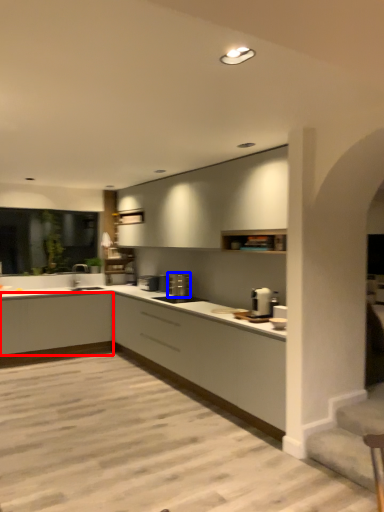
Question: Which point is further to the camera, cabinetry (highlighted by a red box) or appliance (highlighted by a blue box)?

Choices:
 (A) cabinetry
 (B) appliance

Answer: (A)